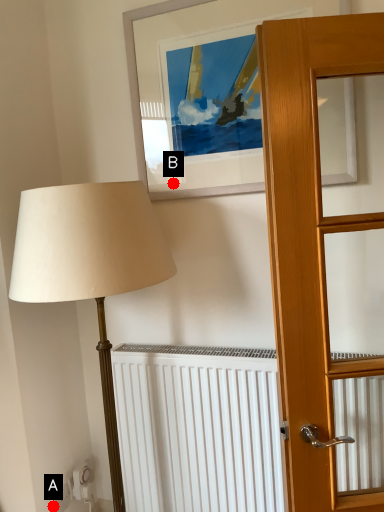
Question: Two points are circled on the image, labeled by A and B beside each circle. Which of the following is the closest to the observer?

Choices:
 (A) A is closer
 (B) B is closer

Answer: (B)